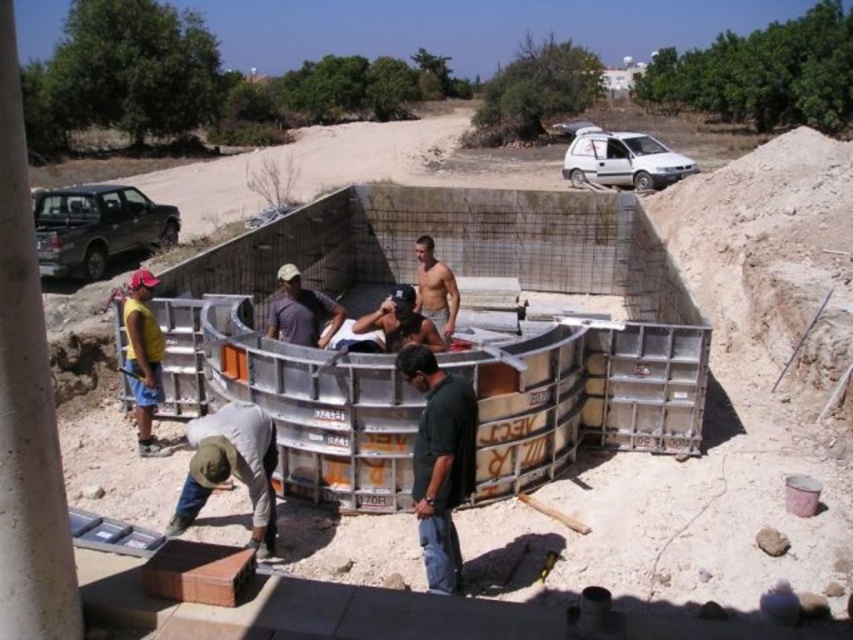
Does green matte shirt at center lie behind dark gray t-shirt at center?

No, green matte shirt at center is in front of dark gray t-shirt at center.

Does point (432, 376) lie in front of point (312, 298)?

Yes, point (432, 376) is in front of point (312, 298).

The image size is (853, 640). Identify the location of green matte shirt at center. click(x=440, y=461).

At what (x,y) coordinates should I click in order to perform the action: click on gray fabric at lower left. Please return your answer as a coordinate pair (x, y). Looking at the image, I should click on (231, 467).

This screenshot has height=640, width=853. What do you see at coordinates (231, 467) in the screenshot?
I see `gray fabric at lower left` at bounding box center [231, 467].

Between point (247, 460) and point (444, 317), which one is positioned in front?

Point (247, 460) is more forward.

Image resolution: width=853 pixels, height=640 pixels. I want to click on gray fabric at lower left, so click(231, 467).

Does point (142, 305) lie in front of point (427, 257)?

Yes.

I want to click on yellow fabric shirt at left, so click(143, 356).

Where is `yellow fabric shirt at left`? Image resolution: width=853 pixels, height=640 pixels. yellow fabric shirt at left is located at coordinates (143, 356).